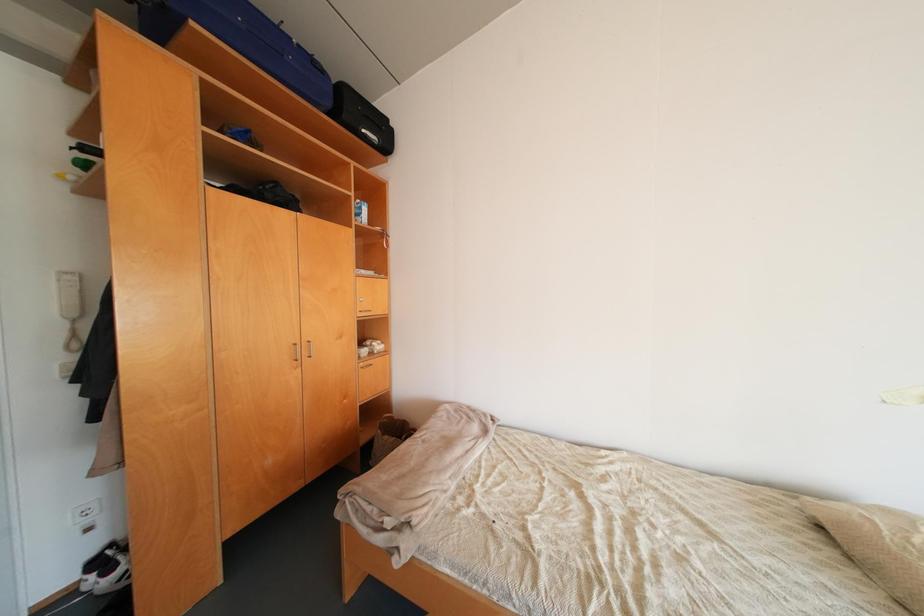
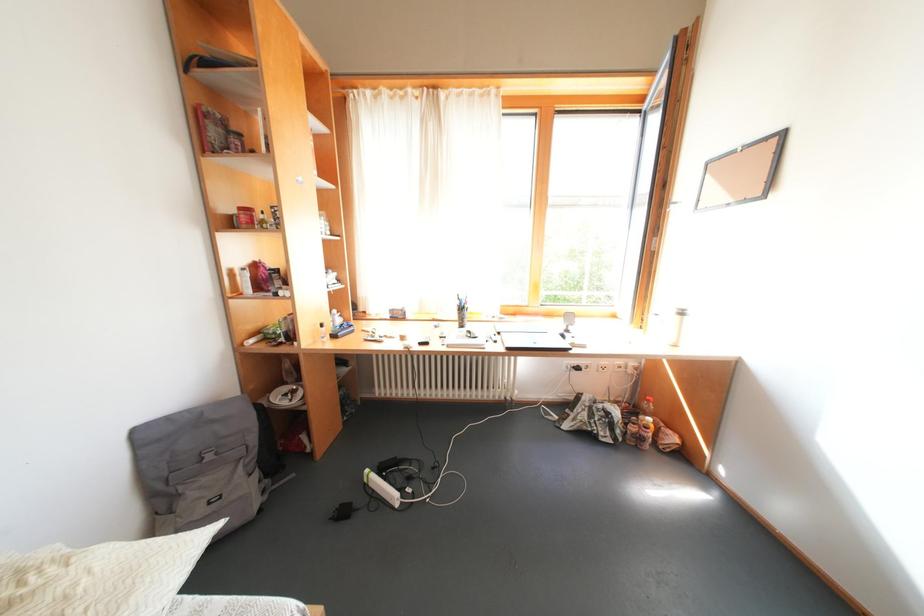
Question: The first image is from the beginning of the video and the second image is from the end. How did the camera likely rotate when shooting the video?

Choices:
 (A) Left
 (B) Right
 (C) Up
 (D) Down

Answer: (B)